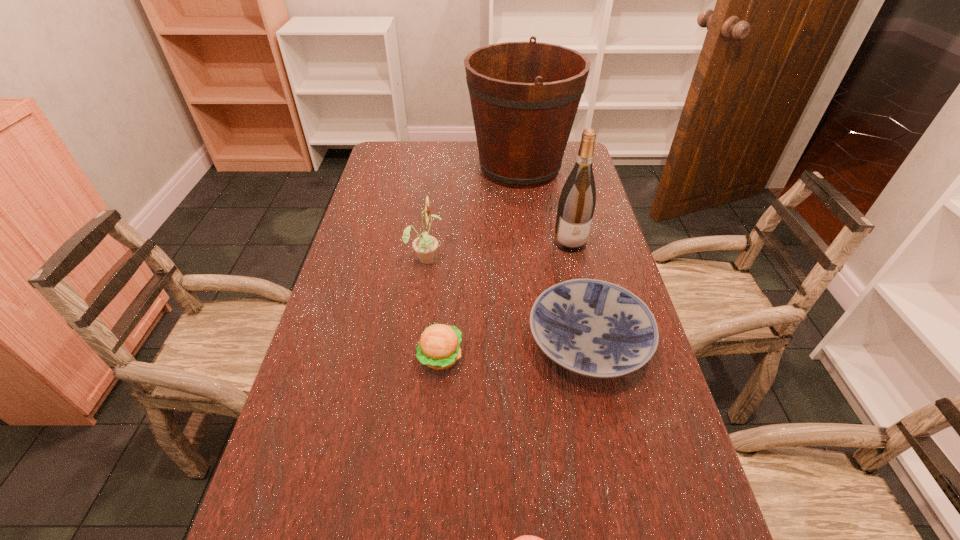
At what (x,y) coordinates should I click in order to perform the action: click on the farthest object. Please return your answer as a coordinate pair (x, y). This screenshot has height=540, width=960. Looking at the image, I should click on (524, 96).

What are the coordinates of `wine bottle` in the screenshot? It's located at (576, 205).

Locate an element on the screen. The width and height of the screenshot is (960, 540). sunflower is located at coordinates (425, 245).

Locate an element on the screen. This screenshot has width=960, height=540. hamburger is located at coordinates (439, 348).

You are a GUI agent. You are given a task and a screenshot of the screen. Output one action in this format:
    pyautogui.click(x=<x>, y=<y>)
    Task: Click on the plate
    The image size is (960, 540).
    Given the screenshot: What is the action you would take?
    pyautogui.click(x=593, y=328)

Locate an element on the screen. Image resolution: width=960 pixels, height=540 pixels. vacant area situated on the front of the farthest object is located at coordinates (526, 221).

This screenshot has height=540, width=960. In order to click on vacant space located on the label of the wine bottle in this screenshot , I will do `click(585, 307)`.

I want to click on vacant space located 0.320m on the front-facing side of the sunflower, so click(554, 258).

The width and height of the screenshot is (960, 540). I want to click on free space located 0.250m on the left of the hamburger, so click(312, 356).

Where is `free location located 0.070m on the front of the plate`? This screenshot has width=960, height=540. free location located 0.070m on the front of the plate is located at coordinates point(607,426).